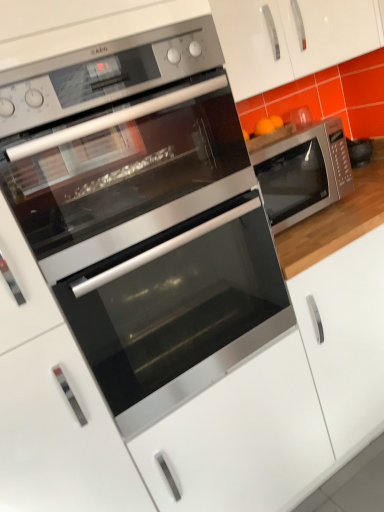
Where is `satin silver oven at center`? Image resolution: width=384 pixels, height=512 pixels. satin silver oven at center is located at coordinates (178, 311).

In order to face stainless steel microwave at right, which ranks as the 2th microwave oven in right-to-left order, should I rotate leftwards or rightwards?

Rotate your view left by about 11.006°.

The image size is (384, 512). What do you see at coordinates (291, 39) in the screenshot?
I see `white glossy cabinet at upper center` at bounding box center [291, 39].

The image size is (384, 512). Describe the element at coordinates (241, 439) in the screenshot. I see `satin white drawer at center, which is counted as the 2th drawer, starting from the left` at that location.

The width and height of the screenshot is (384, 512). I want to click on satin silver oven at center, so click(x=178, y=311).

Is satin silver drawer at center, placed as the 1th drawer when sorted from left to right, at the back of satin white drawer at center, which is counted as the 2th drawer, starting from the left?

No, satin white drawer at center, which is counted as the 2th drawer, starting from the left, is not facing the opposite direction of satin silver drawer at center, placed as the 1th drawer when sorted from left to right.

From a real-world perspective, is satin white drawer at center, which is the 1th drawer in right-to-left order, on top of satin silver drawer at center, placed as the 1th drawer when sorted from left to right?

Actually, satin white drawer at center, which is the 1th drawer in right-to-left order, is physically below satin silver drawer at center, placed as the 1th drawer when sorted from left to right, in the real world.

Is satin white drawer at center, which is counted as the 2th drawer, starting from the left, not near satin silver drawer at center, which is the 2th drawer in right-to-left order?

No, there isn't a large distance between satin white drawer at center, which is counted as the 2th drawer, starting from the left, and satin silver drawer at center, which is the 2th drawer in right-to-left order.

Measure the distance from satin white drawer at center, which is counted as the 2th drawer, starting from the left, to satin silver drawer at center, which is the 2th drawer in right-to-left order.

satin white drawer at center, which is counted as the 2th drawer, starting from the left, and satin silver drawer at center, which is the 2th drawer in right-to-left order, are 11.82 inches apart from each other.

Is white glossy cabinet at upper center looking in the opposite direction of stainless steel microwave at right, marked as the 2th microwave oven in a left-to-right arrangement?

white glossy cabinet at upper center is not turned away from stainless steel microwave at right, marked as the 2th microwave oven in a left-to-right arrangement.

In terms of width, does white glossy cabinet at upper center look wider or thinner when compared to stainless steel microwave at right, which ranks as the 2th microwave oven in front-to-back order?

In the image, white glossy cabinet at upper center appears to be more narrow than stainless steel microwave at right, which ranks as the 2th microwave oven in front-to-back order.

Measure the distance from white glossy cabinet at upper center to stainless steel microwave at right, marked as the 2th microwave oven in a left-to-right arrangement.

white glossy cabinet at upper center and stainless steel microwave at right, marked as the 2th microwave oven in a left-to-right arrangement, are 30.63 centimeters apart.

Based on the photo, which object is further away from the camera, white glossy cabinet at upper center or stainless steel microwave at right, marked as the 2th microwave oven in a left-to-right arrangement?

stainless steel microwave at right, marked as the 2th microwave oven in a left-to-right arrangement.

From a real-world perspective, who is located higher, stainless steel microwave at right, placed as the 1th microwave oven when sorted from front to back, or satin silver drawer at center, which is the 2th drawer in right-to-left order?

stainless steel microwave at right, placed as the 1th microwave oven when sorted from front to back, from a real-world perspective.

Is stainless steel microwave at right, which ranks as the 2th microwave oven in right-to-left order, thinner than satin silver drawer at center, which is the 2th drawer in right-to-left order?

Yes.

From the image's perspective, is stainless steel microwave at right, placed as the 1th microwave oven when sorted from front to back, over satin silver drawer at center, placed as the 1th drawer when sorted from left to right?

Indeed, from the image's perspective, stainless steel microwave at right, placed as the 1th microwave oven when sorted from front to back, is shown above satin silver drawer at center, placed as the 1th drawer when sorted from left to right.

Can you tell me how much stainless steel microwave at right, the second microwave oven when ordered from back to front, and satin silver drawer at center, placed as the 1th drawer when sorted from left to right, differ in facing direction?

0.000429 degrees separate the facing orientations of stainless steel microwave at right, the second microwave oven when ordered from back to front, and satin silver drawer at center, placed as the 1th drawer when sorted from left to right.

Would you say stainless steel microwave at right, which ranks as the 2th microwave oven in right-to-left order, is part of white glossy cabinet at upper center's contents?

No, stainless steel microwave at right, which ranks as the 2th microwave oven in right-to-left order, is located outside of white glossy cabinet at upper center.

Considering the relative sizes of white glossy cabinet at upper center and stainless steel microwave at right, the second microwave oven when ordered from back to front, in the image provided, is white glossy cabinet at upper center taller than stainless steel microwave at right, the second microwave oven when ordered from back to front,?

No.

Can you confirm if white glossy cabinet at upper center is positioned to the left of stainless steel microwave at right, the 1th microwave oven when ordered from left to right?

In fact, white glossy cabinet at upper center is to the right of stainless steel microwave at right, the 1th microwave oven when ordered from left to right.

Does white glossy cabinet at upper center have a greater width compared to stainless steel microwave at right, placed as the 1th microwave oven when sorted from front to back?

In fact, white glossy cabinet at upper center might be narrower than stainless steel microwave at right, placed as the 1th microwave oven when sorted from front to back.

Measure the distance between white glossy cabinet at upper center and satin white drawer at center, which is counted as the 2th drawer, starting from the left.

white glossy cabinet at upper center and satin white drawer at center, which is counted as the 2th drawer, starting from the left, are 3.48 feet apart.

Who is shorter, white glossy cabinet at upper center or satin white drawer at center, which is the 1th drawer in right-to-left order?

white glossy cabinet at upper center is shorter.

Based on the photo, from the image's perspective, which object appears higher, white glossy cabinet at upper center or satin white drawer at center, which is counted as the 2th drawer, starting from the left?

white glossy cabinet at upper center, from the image's perspective.

Does point (356, 21) lie in front of point (201, 493)?

No, it is behind (201, 493).

From the image's perspective, is stainless steel microwave at right, which ranks as the 2th microwave oven in front-to-back order, below stainless steel microwave at right, placed as the 1th microwave oven when sorted from front to back?

Actually, stainless steel microwave at right, which ranks as the 2th microwave oven in front-to-back order, appears above stainless steel microwave at right, placed as the 1th microwave oven when sorted from front to back, in the image.

I want to click on microwave oven above the stainless steel microwave at right, the first microwave oven viewed from the back (from a real-world perspective), so click(x=145, y=216).

Does stainless steel microwave at right, the 1th microwave oven when ordered from right to left, have a larger size compared to stainless steel microwave at right, the second microwave oven when ordered from back to front?

No, stainless steel microwave at right, the 1th microwave oven when ordered from right to left, is not bigger than stainless steel microwave at right, the second microwave oven when ordered from back to front.

From the image's perspective, between white glossy cabinet at upper center and satin silver drawer at center, which is the 2th drawer in right-to-left order, which one is located above?

white glossy cabinet at upper center.

Is white glossy cabinet at upper center spatially inside satin silver drawer at center, placed as the 1th drawer when sorted from left to right, or outside of it?

white glossy cabinet at upper center is not enclosed by satin silver drawer at center, placed as the 1th drawer when sorted from left to right.

What are the coordinates of `cabinetry above the satin silver drawer at center, which is the 2th drawer in right-to-left order (from the image's perspective)` in the screenshot? It's located at (291, 39).

Is white glossy cabinet at upper center with satin silver drawer at center, which is the 2th drawer in right-to-left order?

No, white glossy cabinet at upper center is not next to satin silver drawer at center, which is the 2th drawer in right-to-left order.

This screenshot has width=384, height=512. Identify the location of drawer on the right of satin silver drawer at center, placed as the 1th drawer when sorted from left to right. (241, 439).

The height and width of the screenshot is (512, 384). What are the coordinates of `cabinetry above the stainless steel microwave at right, which ranks as the 2th microwave oven in front-to-back order (from a real-world perspective)` in the screenshot? It's located at point(291,39).

Looking at the image, which one is located closer to stainless steel microwave at right, the first microwave oven viewed from the back, satin white drawer at center, which is the 1th drawer in right-to-left order, or satin silver drawer at center, which is the 2th drawer in right-to-left order?

satin white drawer at center, which is the 1th drawer in right-to-left order, lies closer to stainless steel microwave at right, the first microwave oven viewed from the back, than the other object.

Based on their spatial positions, is stainless steel microwave at right, placed as the 1th microwave oven when sorted from front to back, or satin silver drawer at center, placed as the 1th drawer when sorted from left to right, further from white glossy cabinet at upper center?

satin silver drawer at center, placed as the 1th drawer when sorted from left to right.

Looking at the image, which one is located further to stainless steel microwave at right, the first microwave oven viewed from the back, satin silver drawer at center, which is the 2th drawer in right-to-left order, or stainless steel microwave at right, placed as the 1th microwave oven when sorted from front to back?

satin silver drawer at center, which is the 2th drawer in right-to-left order, is further to stainless steel microwave at right, the first microwave oven viewed from the back.

Looking at the image, which one is located closer to white glossy cabinet at upper center, stainless steel microwave at right, which ranks as the 2th microwave oven in front-to-back order, or satin silver oven at center?

stainless steel microwave at right, which ranks as the 2th microwave oven in front-to-back order.

Based on their spatial positions, is stainless steel microwave at right, the first microwave oven viewed from the back, or satin white drawer at center, which is counted as the 2th drawer, starting from the left, closer to white glossy cabinet at upper center?

stainless steel microwave at right, the first microwave oven viewed from the back, is positioned closer to the anchor white glossy cabinet at upper center.

From the image, which object appears to be nearer to satin white drawer at center, which is counted as the 2th drawer, starting from the left, stainless steel microwave at right, placed as the 1th microwave oven when sorted from front to back, or stainless steel microwave at right, the 1th microwave oven when ordered from right to left?

The object closer to satin white drawer at center, which is counted as the 2th drawer, starting from the left, is stainless steel microwave at right, placed as the 1th microwave oven when sorted from front to back.

Considering their positions, is white glossy cabinet at upper center positioned further to satin white drawer at center, which is the 1th drawer in right-to-left order, than satin silver oven at center?

white glossy cabinet at upper center is positioned further to the anchor satin white drawer at center, which is the 1th drawer in right-to-left order.

From the image, which object appears to be farther from satin white drawer at center, which is the 1th drawer in right-to-left order, stainless steel microwave at right, the 1th microwave oven when ordered from right to left, or stainless steel microwave at right, which ranks as the 2th microwave oven in right-to-left order?

Based on the image, stainless steel microwave at right, the 1th microwave oven when ordered from right to left, appears to be further to satin white drawer at center, which is the 1th drawer in right-to-left order.

You are a GUI agent. You are given a task and a screenshot of the screen. Output one action in this format:
    pyautogui.click(x=<x>, y=<y>)
    Task: Click on the oven between white glossy cabinet at upper center and satin white drawer at center, which is the 1th drawer in right-to-left order, in the up-down direction
    
    Given the screenshot: What is the action you would take?
    pyautogui.click(x=178, y=311)

Find the location of a particular element. This screenshot has width=384, height=512. oven between stainless steel microwave at right, marked as the 2th microwave oven in a left-to-right arrangement, and satin white drawer at center, which is the 1th drawer in right-to-left order, vertically is located at coordinates (178, 311).

The width and height of the screenshot is (384, 512). Identify the location of drawer between stainless steel microwave at right, which ranks as the 2th microwave oven in front-to-back order, and satin white drawer at center, which is the 1th drawer in right-to-left order, in the up-down direction. (60, 435).

Where is `oven between white glossy cabinet at upper center and satin silver drawer at center, placed as the 1th drawer when sorted from left to right, in the vertical direction`? The height and width of the screenshot is (512, 384). oven between white glossy cabinet at upper center and satin silver drawer at center, placed as the 1th drawer when sorted from left to right, in the vertical direction is located at coordinates (178, 311).